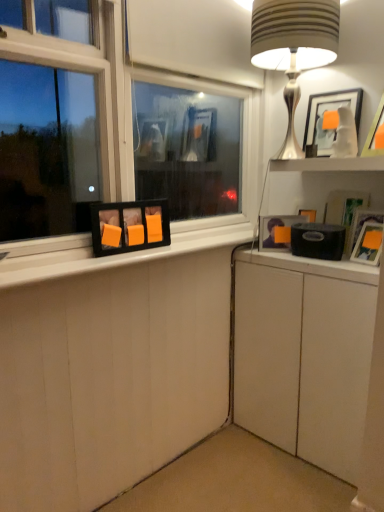
Describe the element at coordinates (328, 164) in the screenshot. I see `white glossy shelf at upper right` at that location.

How much space does orange matte picture frame at lower left, positioned as the first picture frame in left-to-right order, occupy vertically?

It is 7.86 inches.

What do you see at coordinates (294, 47) in the screenshot?
I see `satin silver table lamp at upper right` at bounding box center [294, 47].

Measure the distance between point (89, 256) and camera.

1.50 meters.

You are a GUI agent. You are given a task and a screenshot of the screen. Output one action in this format:
    pyautogui.click(x=<x>, y=<y>)
    Task: Click on the white glossy shelf at upper right
    
    Given the screenshot: What is the action you would take?
    pyautogui.click(x=328, y=164)

Which is correct: satin silver table lamp at upper right is inside white matte cabinet at lower right, or outside of it?

satin silver table lamp at upper right exists outside the volume of white matte cabinet at lower right.

Considering the positions of objects satin silver table lamp at upper right and white matte cabinet at lower right in the image provided, who is behind, satin silver table lamp at upper right or white matte cabinet at lower right?

white matte cabinet at lower right is further away from the camera.

Is satin silver table lamp at upper right positioned far away from white matte cabinet at lower right?

satin silver table lamp at upper right is near white matte cabinet at lower right, not far away.

In the scene shown: From the image's perspective, relative to white glossy shelf at upper right, is matte black frame at left above or below?

Based on their image positions, matte black frame at left is located beneath white glossy shelf at upper right.

Is point (88, 266) farther from viewer compared to point (306, 163)?

No, (88, 266) is in front of (306, 163).

Can you confirm if matte black frame at left is smaller than white glossy shelf at upper right?

Incorrect, matte black frame at left is not smaller in size than white glossy shelf at upper right.

Is matte black frame at left behind white glossy shelf at upper right?

No, matte black frame at left is in front of white glossy shelf at upper right.

From a real-world perspective, does matte white picture frame at upper right, the third picture frame from the left, sit lower than matte black picture frame at right, positioned as the 3th picture frame in right-to-left order?

No.

At what (x,y) coordinates should I click in order to perform the action: click on the 3rd picture frame directly beneath the matte white picture frame at upper right, acting as the 2th picture frame starting from the right (from a real-world perspective). Please return your answer as a coordinate pair (x, y). The height and width of the screenshot is (512, 384). Looking at the image, I should click on pyautogui.click(x=277, y=230).

Between matte white picture frame at upper right, the third picture frame from the left, and matte black picture frame at right, positioned as the 3th picture frame in right-to-left order, which one appears on the left side from the viewer's perspective?

matte black picture frame at right, positioned as the 3th picture frame in right-to-left order, is more to the left.

Between matte black picture frame at right, positioned as the 3th picture frame in right-to-left order, and matte black picture frame at right, which is the first picture frame in right-to-left order, which one is positioned in front?

matte black picture frame at right, which is the first picture frame in right-to-left order, is more forward.

Who is bigger, matte black picture frame at right, which is counted as the second picture frame, starting from the left, or matte black picture frame at right, the fourth picture frame viewed from the left?

matte black picture frame at right, which is counted as the second picture frame, starting from the left, is bigger.

Can you confirm if matte black picture frame at right, which is counted as the second picture frame, starting from the left, is wider than matte black picture frame at right, which is the first picture frame in right-to-left order?

Yes, matte black picture frame at right, which is counted as the second picture frame, starting from the left, is wider than matte black picture frame at right, which is the first picture frame in right-to-left order.

Between point (294, 217) and point (373, 246), which one is positioned in front?

The point (373, 246) is closer to the camera.

Considering the positions of points (324, 109) and (342, 386), is point (324, 109) farther from camera compared to point (342, 386)?

Yes, it is.

Is matte white picture frame at upper right, the third picture frame from the left, in contact with white matte cabinet at lower right?

matte white picture frame at upper right, the third picture frame from the left, and white matte cabinet at lower right are clearly separated.

This screenshot has height=512, width=384. What are the coordinates of `the 1st picture frame to the right of the white matte cabinet at lower right, starting your count from the anchor` in the screenshot? It's located at (329, 112).

Do you think matte white picture frame at upper right, the third picture frame from the left, is within white matte cabinet at lower right, or outside of it?

matte white picture frame at upper right, the third picture frame from the left, is located beyond the bounds of white matte cabinet at lower right.

This screenshot has width=384, height=512. In order to click on the 3rd picture frame to the left when counting from the matte black picture frame at right, which is the first picture frame in right-to-left order in this screenshot , I will do `click(129, 226)`.

Does point (376, 224) appear closer or farther from the camera than point (140, 201)?

Clearly, point (376, 224) is closer to the camera than point (140, 201).

Does matte black picture frame at right, the fourth picture frame viewed from the left, have a lesser width compared to orange matte picture frame at lower left, positioned as the first picture frame in left-to-right order?

No, matte black picture frame at right, the fourth picture frame viewed from the left, is not thinner than orange matte picture frame at lower left, positioned as the first picture frame in left-to-right order.

Is matte black picture frame at right, the fourth picture frame viewed from the left, positioned behind orange matte picture frame at lower left, positioned as the first picture frame in left-to-right order?

Yes, it is.

Is white matte cabinet at lower right inside or outside of matte black picture frame at right, the fourth picture frame viewed from the left?

white matte cabinet at lower right is located beyond the bounds of matte black picture frame at right, the fourth picture frame viewed from the left.

Considering the sizes of objects white matte cabinet at lower right and matte black picture frame at right, which is the first picture frame in right-to-left order, in the image provided, who is wider, white matte cabinet at lower right or matte black picture frame at right, which is the first picture frame in right-to-left order,?

white matte cabinet at lower right.

Can you confirm if white matte cabinet at lower right is positioned to the right of matte black picture frame at right, the fourth picture frame viewed from the left?

No.

Which object is further away from the camera taking this photo, white matte cabinet at lower right or matte black picture frame at right, which is the first picture frame in right-to-left order?

Positioned behind is matte black picture frame at right, which is the first picture frame in right-to-left order.

Image resolution: width=384 pixels, height=512 pixels. What are the coordinates of `table lamp that appears above the white matte cabinet at lower right (from a real-world perspective)` in the screenshot? It's located at (294, 47).

Identify the location of shelf behind the matte black frame at left. The image size is (384, 512). (328, 164).

Consider the image. When comparing their distances from white matte cabinet at lower right, does orange matte picture frame at lower left, positioned as the first picture frame in left-to-right order, or matte black picture frame at right, the fourth picture frame viewed from the left, seem further?

orange matte picture frame at lower left, positioned as the first picture frame in left-to-right order.

Looking at the image, which one is located closer to matte black picture frame at right, positioned as the 3th picture frame in right-to-left order, matte black picture frame at right, the fourth picture frame viewed from the left, or white glossy shelf at upper right?

Among the two, white glossy shelf at upper right is located nearer to matte black picture frame at right, positioned as the 3th picture frame in right-to-left order.

From the image, which object appears to be farther from matte black picture frame at right, which is counted as the second picture frame, starting from the left, white matte cabinet at lower right or orange matte picture frame at lower left, positioned as the first picture frame in left-to-right order?

The object further to matte black picture frame at right, which is counted as the second picture frame, starting from the left, is orange matte picture frame at lower left, positioned as the first picture frame in left-to-right order.

From the image, which object appears to be nearer to matte black picture frame at right, positioned as the 3th picture frame in right-to-left order, satin silver table lamp at upper right or white glossy shelf at upper right?

Based on the image, white glossy shelf at upper right appears to be nearer to matte black picture frame at right, positioned as the 3th picture frame in right-to-left order.

Based on their spatial positions, is satin silver table lamp at upper right or matte black picture frame at right, positioned as the 3th picture frame in right-to-left order, closer to matte black picture frame at right, the fourth picture frame viewed from the left?

matte black picture frame at right, positioned as the 3th picture frame in right-to-left order.

When comparing their distances from white matte cabinet at lower right, does matte black picture frame at right, the fourth picture frame viewed from the left, or orange matte picture frame at lower left, positioned as the first picture frame in left-to-right order, seem further?

Based on the image, orange matte picture frame at lower left, positioned as the first picture frame in left-to-right order, appears to be further to white matte cabinet at lower right.

Looking at this image, which object lies nearer to the anchor point orange matte picture frame at lower left, positioned as the first picture frame in left-to-right order, white matte cabinet at lower right or white glossy shelf at upper right?

white matte cabinet at lower right lies closer to orange matte picture frame at lower left, positioned as the first picture frame in left-to-right order, than the other object.

When comparing their distances from matte white picture frame at upper right, the third picture frame from the left, does white glossy shelf at upper right or matte black frame at left seem closer?

white glossy shelf at upper right is closer to matte white picture frame at upper right, the third picture frame from the left.

At what (x,y) coordinates should I click in order to perform the action: click on window sill between white glossy shelf at upper right and white matte cabinet at lower right from top to bottom. Please return your answer as a coordinate pair (x, y). Image resolution: width=384 pixels, height=512 pixels. Looking at the image, I should click on (114, 255).

The width and height of the screenshot is (384, 512). Identify the location of cabinetry situated between orange matte picture frame at lower left, positioned as the first picture frame in left-to-right order, and matte black picture frame at right, which is the first picture frame in right-to-left order, from left to right. (304, 355).

Find the location of a particular element. This screenshot has width=384, height=512. cabinetry between matte black frame at left and matte black picture frame at right, which is counted as the second picture frame, starting from the left, from front to back is located at coordinates (304, 355).

Find the location of a particular element. This screenshot has width=384, height=512. window sill between satin silver table lamp at upper right and white matte cabinet at lower right in the up-down direction is located at coordinates (114, 255).